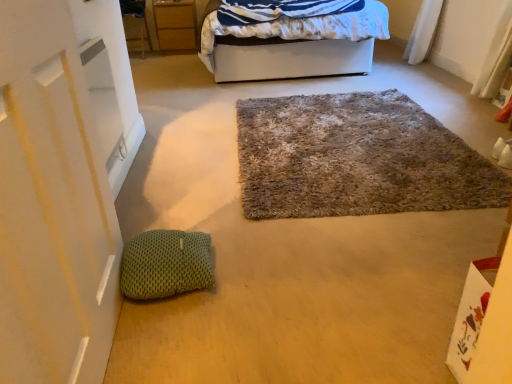
Locate an element on the screen. This screenshot has width=512, height=384. free space in front of green knitted pillow at lower left is located at coordinates (170, 330).